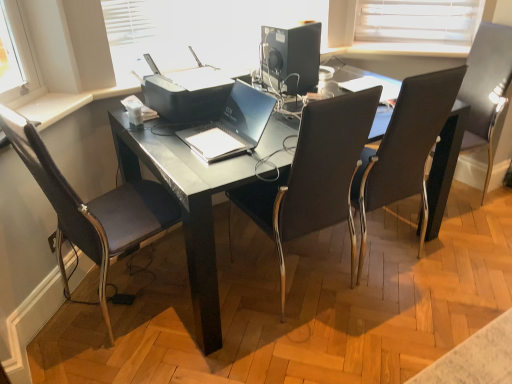
Question: Is satin black laptop at center at the left side of black plastic desktop computer at upper center?

Choices:
 (A) no
 (B) yes

Answer: (B)

Question: Can you confirm if satin black laptop at center is smaller than black plastic desktop computer at upper center?

Choices:
 (A) yes
 (B) no

Answer: (A)

Question: Is satin black laptop at center positioned far away from black plastic desktop computer at upper center?

Choices:
 (A) no
 (B) yes

Answer: (A)

Question: Is satin black laptop at center oriented towards black plastic desktop computer at upper center?

Choices:
 (A) no
 (B) yes

Answer: (A)

Question: Considering the relative sizes of satin black laptop at center and black plastic desktop computer at upper center in the image provided, is satin black laptop at center taller than black plastic desktop computer at upper center?

Choices:
 (A) yes
 (B) no

Answer: (B)

Question: Is black leather chair at upper right, which is counted as the 1th chair, starting from the right, taller or shorter than black plastic desktop computer at upper center?

Choices:
 (A) tall
 (B) short

Answer: (A)

Question: Considering their positions, is black leather chair at upper right, which is counted as the 1th chair, starting from the right, located in front of or behind black plastic desktop computer at upper center?

Choices:
 (A) behind
 (B) front

Answer: (B)

Question: From the image's perspective, is black leather chair at upper right, acting as the 4th chair starting from the left, positioned above or below black plastic desktop computer at upper center?

Choices:
 (A) above
 (B) below

Answer: (B)

Question: Looking at the image, does black leather chair at upper right, which is counted as the 1th chair, starting from the right, seem bigger or smaller compared to black plastic desktop computer at upper center?

Choices:
 (A) small
 (B) big

Answer: (B)

Question: Considering the positions of point (145, 34) and point (114, 206), is point (145, 34) closer or farther from the camera than point (114, 206)?

Choices:
 (A) farther
 (B) closer

Answer: (A)

Question: Is matte plastic printer at upper center inside the boundaries of dark brown leather chair at left, the 4th chair positioned from the right, or outside?

Choices:
 (A) inside
 (B) outside

Answer: (B)

Question: Is matte plastic printer at upper center bigger or smaller than dark brown leather chair at left, the 4th chair positioned from the right?

Choices:
 (A) small
 (B) big

Answer: (A)

Question: In the image, is matte plastic printer at upper center positioned in front of or behind dark brown leather chair at left, the 4th chair positioned from the right?

Choices:
 (A) front
 (B) behind

Answer: (B)

Question: From a real-world perspective, is black leather chair at center, which is the third chair in right-to-left order, physically located above or below black leather chair at center, placed as the third chair when sorted from left to right?

Choices:
 (A) below
 (B) above

Answer: (B)

Question: Considering the positions of black leather chair at center, arranged as the 2th chair when viewed from the left, and black leather chair at center, placed as the third chair when sorted from left to right, in the image, is black leather chair at center, arranged as the 2th chair when viewed from the left, taller or shorter than black leather chair at center, placed as the third chair when sorted from left to right,?

Choices:
 (A) short
 (B) tall

Answer: (A)